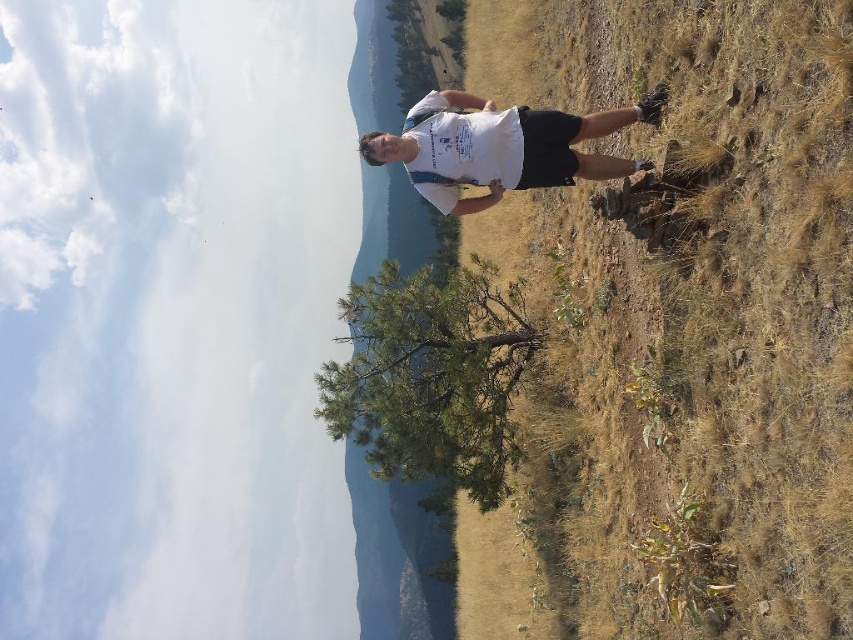
Question: Which point is farther to the camera?

Choices:
 (A) 772,628
 (B) 572,124

Answer: (B)

Question: Does brown grass at right lie in front of white cotton shirt at center?

Choices:
 (A) yes
 (B) no

Answer: (A)

Question: Can you confirm if brown grass at right is positioned to the left of white cotton shirt at center?

Choices:
 (A) yes
 (B) no

Answer: (B)

Question: Is brown grass at right closer to the viewer compared to white cotton shirt at center?

Choices:
 (A) yes
 (B) no

Answer: (A)